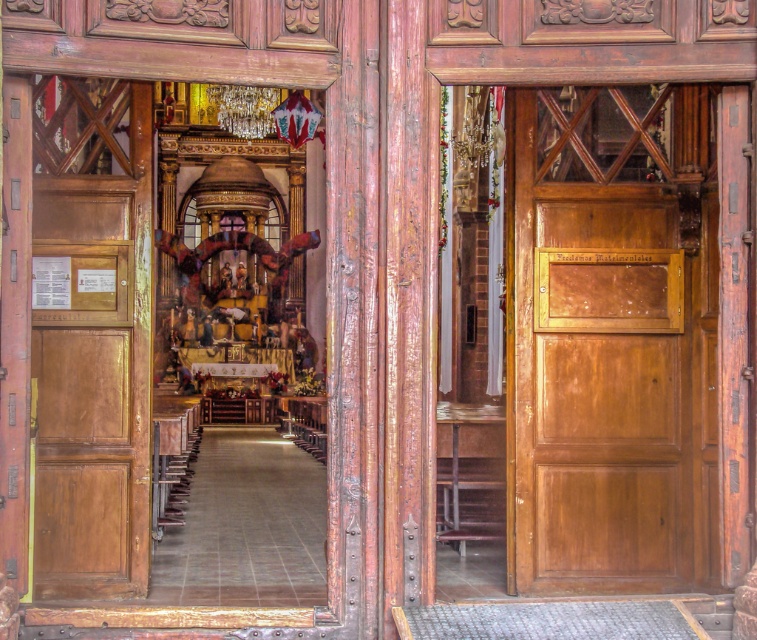
Does matte wood door at right appear over matte wood door at left?

Indeed, matte wood door at right is positioned over matte wood door at left.

Does matte wood door at right lie behind matte wood door at left?

Yes.

Who is more forward, [674,480] or [89,529]?

Point [89,529] is in front.

You are a GUI agent. You are given a task and a screenshot of the screen. Output one action in this format:
    pyautogui.click(x=<x>, y=<y>)
    Task: Click on the matte wood door at right
    
    Given the screenshot: What is the action you would take?
    pyautogui.click(x=612, y=342)